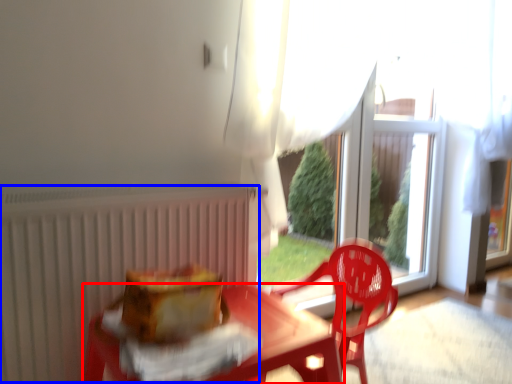
Question: Among these objects, which one is farthest to the camera, table (highlighted by a red box) or radiator (highlighted by a blue box)?

Choices:
 (A) table
 (B) radiator

Answer: (B)